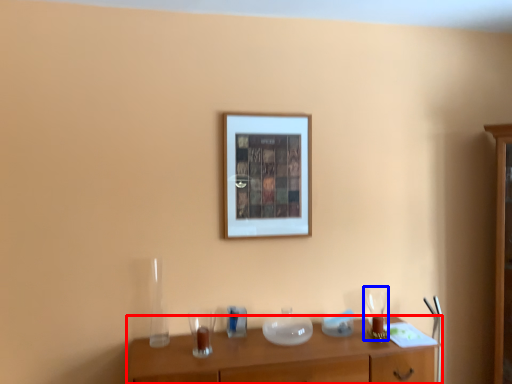
Question: Which object is further to the camera taking this photo, table (highlighted by a red box) or wine glass (highlighted by a blue box)?

Choices:
 (A) table
 (B) wine glass

Answer: (B)